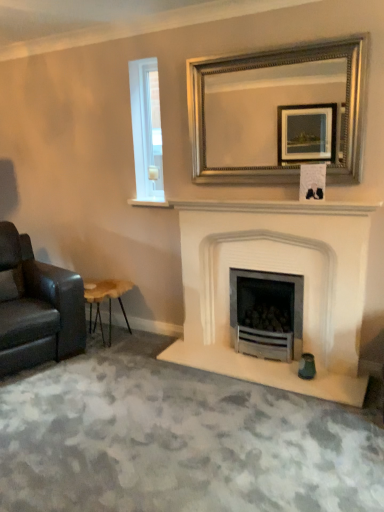
Question: Does wooden stool at lower left have a lesser width compared to white marble fireplace at center?

Choices:
 (A) yes
 (B) no

Answer: (B)

Question: Is wooden stool at lower left closer to camera compared to white marble fireplace at center?

Choices:
 (A) no
 (B) yes

Answer: (A)

Question: Does wooden stool at lower left have a lesser height compared to white marble fireplace at center?

Choices:
 (A) no
 (B) yes

Answer: (A)

Question: Considering the relative sizes of wooden stool at lower left and white marble fireplace at center in the image provided, is wooden stool at lower left taller than white marble fireplace at center?

Choices:
 (A) no
 (B) yes

Answer: (B)

Question: Is white marble fireplace at center surrounded by wooden stool at lower left?

Choices:
 (A) no
 (B) yes

Answer: (A)

Question: Does wooden stool at lower left turn towards white marble fireplace at center?

Choices:
 (A) yes
 (B) no

Answer: (B)

Question: Is wooden stool at lower left to the right of silver/golden metallic mirror at upper center from the viewer's perspective?

Choices:
 (A) yes
 (B) no

Answer: (B)

Question: Is wooden stool at lower left closer to camera compared to silver/golden metallic mirror at upper center?

Choices:
 (A) yes
 (B) no

Answer: (B)

Question: Can you confirm if wooden stool at lower left is shorter than silver/golden metallic mirror at upper center?

Choices:
 (A) no
 (B) yes

Answer: (B)

Question: Is wooden stool at lower left to the left of silver/golden metallic mirror at upper center from the viewer's perspective?

Choices:
 (A) yes
 (B) no

Answer: (A)

Question: Is the depth of wooden stool at lower left greater than that of silver/golden metallic mirror at upper center?

Choices:
 (A) yes
 (B) no

Answer: (A)

Question: Does wooden stool at lower left have a greater height compared to silver/golden metallic mirror at upper center?

Choices:
 (A) no
 (B) yes

Answer: (A)

Question: From the image's perspective, is white marble fireplace at center beneath white glass window at upper left?

Choices:
 (A) no
 (B) yes

Answer: (B)